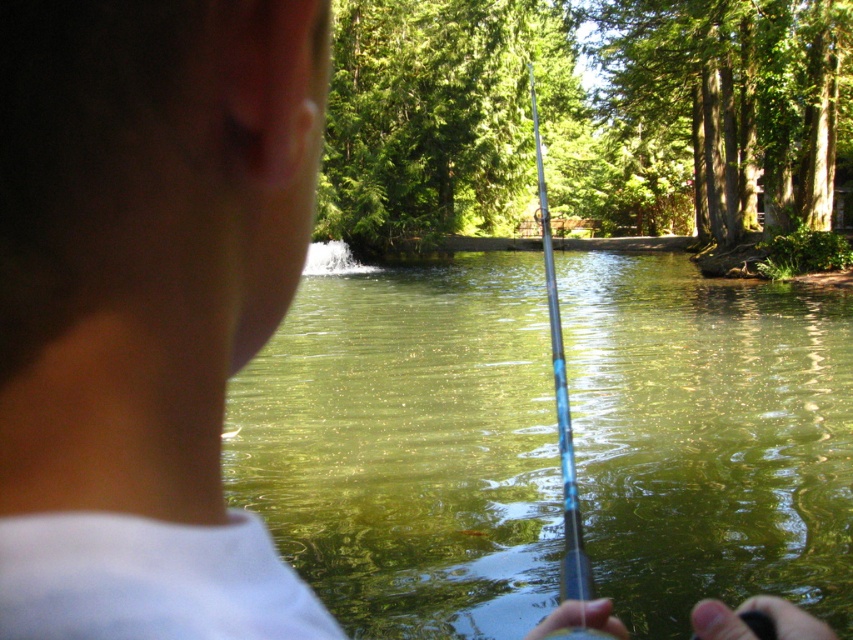
You are a photographer trying to capture a closeup of the green translucent water at center and the blue glossy fishing pole at center. Which object should you focus on first to ensure it appears sharp in your photo?

The green translucent water at center is closer to the viewer than the blue glossy fishing pole at center, so you should focus on the green translucent water at center first to ensure it appears sharp.

You are a drone operator trying to capture the exact location of the fishing rod tip in the image. The fishing rod extends from the bottom right to the upper left. There is a point marked at coordinates point (408,444). Is this point closer to the tip of the fishing rod or the handle?

The point (408,444) corresponds to green translucent water at center, so it is not near the fishing rod. The fishing rod extends from the bottom right to upper left, so the tip would be near the upper left end of the rod. Therefore, the marked point is not near either the tip or the handle of the fishing rod.

You are a photographer trying to capture the fishing rod and the water in the scene. Based on the image, which object occupies a larger area in the frame? The green translucent water at center or the blue glossy fishing pole at center?

The green translucent water at center might be wider than blue glossy fishing pole at center, so the water likely occupies a larger area in the frame.